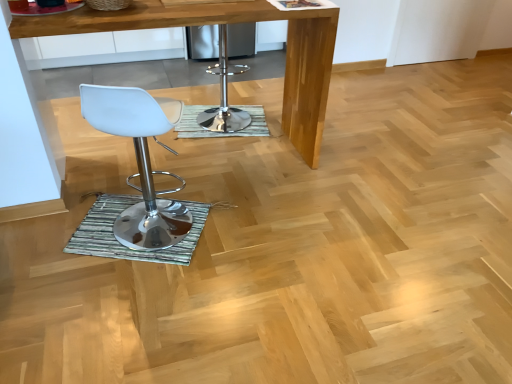
Describe the element at coordinates (220, 132) in the screenshot. This screenshot has height=384, width=512. I see `green textured mat at center, which is the second mat from bottom to top` at that location.

Find the location of a particular element. green textured mat at center, the 2th mat positioned from the top is located at coordinates (125, 246).

This screenshot has height=384, width=512. I want to click on green textured mat at center, which is the second mat from bottom to top, so click(x=220, y=132).

Does white plastic stool at left turn towards green textured mat at center, marked as the first mat in a back-to-front arrangement?

Yes, white plastic stool at left is oriented towards green textured mat at center, marked as the first mat in a back-to-front arrangement.

Which of these two, white plastic stool at left or green textured mat at center, which is the second mat from bottom to top, stands taller?

With more height is white plastic stool at left.

Would you say white plastic stool at left is to the left or to the right of green textured mat at center, which is the second mat from bottom to top, in the picture?

In the image, white plastic stool at left appears on the left side of green textured mat at center, which is the second mat from bottom to top.

What's the angular difference between white plastic stool at left and green textured mat at center, which is the second mat from bottom to top,'s facing directions?

There is a 169-degree angle between the facing directions of white plastic stool at left and green textured mat at center, which is the second mat from bottom to top.

From a real-world perspective, is white plastic stool at left positioned under wooden table at center based on gravity?

Yes, from a real-world perspective, white plastic stool at left is beneath wooden table at center.

How much distance is there between white plastic stool at left and wooden table at center?

The distance of white plastic stool at left from wooden table at center is 32.89 inches.

What's the angular difference between white plastic stool at left and wooden table at center's facing directions?

They differ by 23.8 degrees in their facing directions.

Is white plastic stool at left positioned with its back to wooden table at center?

white plastic stool at left does not have its back to wooden table at center.

Could you tell me if white plastic stool at left is facing polished chrome bar stool at center?

Yes, white plastic stool at left is oriented towards polished chrome bar stool at center.

Considering the positions of objects white plastic stool at left and polished chrome bar stool at center in the image provided, who is behind, white plastic stool at left or polished chrome bar stool at center?

polished chrome bar stool at center is more distant.

Can you see white plastic stool at left touching polished chrome bar stool at center?

No, white plastic stool at left is not next to polished chrome bar stool at center.

Is white plastic stool at left thinner than polished chrome bar stool at center?

Correct, the width of white plastic stool at left is less than that of polished chrome bar stool at center.

Are polished chrome bar stool at center and green textured mat at center, which is counted as the first mat, starting from the bottom, located far from each other?

polished chrome bar stool at center is far away from green textured mat at center, which is counted as the first mat, starting from the bottom.

Between polished chrome bar stool at center and green textured mat at center, the 2th mat positioned from the top, which one is positioned behind?

polished chrome bar stool at center is further from the camera.

Between polished chrome bar stool at center and green textured mat at center, which is counted as the first mat, starting from the bottom, which one has smaller size?

With smaller size is green textured mat at center, which is counted as the first mat, starting from the bottom.

From a real-world perspective, does polished chrome bar stool at center stand above green textured mat at center, the 2th mat positioned from the top?

Yes, from a real-world perspective, polished chrome bar stool at center is over green textured mat at center, the 2th mat positioned from the top

Does wooden table at center have a lesser width compared to white plastic stool at left?

Incorrect, the width of wooden table at center is not less than that of white plastic stool at left.

From a real-world perspective, relative to white plastic stool at left, is wooden table at center vertically above or below?

wooden table at center is situated higher than white plastic stool at left in the real world.

Could white plastic stool at left be considered to be inside wooden table at center?

No, white plastic stool at left is located outside of wooden table at center.

Who is taller, wooden table at center or white plastic stool at left?

wooden table at center is taller.

How different are the orientations of polished chrome bar stool at center and green textured mat at center, the 1th mat when ordered from top to bottom, in degrees?

The facing directions of polished chrome bar stool at center and green textured mat at center, the 1th mat when ordered from top to bottom, are 26.5 degrees apart.

Considering the relative sizes of polished chrome bar stool at center and green textured mat at center, the second mat positioned from the front, in the image provided, is polished chrome bar stool at center taller than green textured mat at center, the second mat positioned from the front,?

Yes, polished chrome bar stool at center is taller than green textured mat at center, the second mat positioned from the front.

Based on the photo, how much distance is there between polished chrome bar stool at center and green textured mat at center, the 1th mat when ordered from top to bottom?

polished chrome bar stool at center is 3.29 inches from green textured mat at center, the 1th mat when ordered from top to bottom.

Does point (220, 61) appear closer or farther from the camera than point (178, 128)?

Point (220, 61) is farther from the camera than point (178, 128).

Considering the sizes of objects green textured mat at center, the 2th mat when ordered from back to front, and green textured mat at center, marked as the first mat in a back-to-front arrangement, in the image provided, who is bigger, green textured mat at center, the 2th mat when ordered from back to front, or green textured mat at center, marked as the first mat in a back-to-front arrangement,?

With larger size is green textured mat at center, marked as the first mat in a back-to-front arrangement.

Can you confirm if green textured mat at center, the 2th mat positioned from the top, is thinner than green textured mat at center, marked as the first mat in a back-to-front arrangement?

Indeed, green textured mat at center, the 2th mat positioned from the top, has a lesser width compared to green textured mat at center, marked as the first mat in a back-to-front arrangement.

From a real-world perspective, between green textured mat at center, arranged as the first mat when viewed from the front, and green textured mat at center, the second mat positioned from the front, who is vertically higher?

green textured mat at center, arranged as the first mat when viewed from the front.

The height and width of the screenshot is (384, 512). What are the coordinates of `chair that appears below the green textured mat at center, the second mat positioned from the front (from the image's perspective)` in the screenshot? It's located at (140, 162).

The image size is (512, 384). Find the location of `table above the white plastic stool at left (from a real-world perspective)`. table above the white plastic stool at left (from a real-world perspective) is located at coordinates (225, 23).

From the image, which object appears to be farther from green textured mat at center, marked as the first mat in a back-to-front arrangement, wooden table at center or white plastic stool at left?

Based on the image, white plastic stool at left appears to be further to green textured mat at center, marked as the first mat in a back-to-front arrangement.

Which object lies nearer to the anchor point polished chrome bar stool at center, green textured mat at center, marked as the first mat in a back-to-front arrangement, or green textured mat at center, the 2th mat positioned from the top?

green textured mat at center, marked as the first mat in a back-to-front arrangement, is positioned closer to the anchor polished chrome bar stool at center.

Looking at the image, which one is located closer to white plastic stool at left, wooden table at center or green textured mat at center, marked as the first mat in a back-to-front arrangement?

green textured mat at center, marked as the first mat in a back-to-front arrangement, is closer to white plastic stool at left.

Looking at the image, which one is located further to white plastic stool at left, wooden table at center or polished chrome bar stool at center?

wooden table at center is positioned further to the anchor white plastic stool at left.

Which object lies nearer to the anchor point wooden table at center, green textured mat at center, the 2th mat positioned from the top, or green textured mat at center, marked as the first mat in a back-to-front arrangement?

green textured mat at center, marked as the first mat in a back-to-front arrangement, is positioned closer to the anchor wooden table at center.

Consider the image. From the image, which object appears to be nearer to wooden table at center, green textured mat at center, which is the second mat from bottom to top, or white plastic stool at left?

green textured mat at center, which is the second mat from bottom to top, is positioned closer to the anchor wooden table at center.

Looking at the image, which one is located further to polished chrome bar stool at center, green textured mat at center, which is the second mat from bottom to top, or white plastic stool at left?

Among the two, white plastic stool at left is located further to polished chrome bar stool at center.

Consider the image. Based on their spatial positions, is white plastic stool at left or polished chrome bar stool at center further from wooden table at center?

white plastic stool at left is further to wooden table at center.

Where is `bar stool located between white plastic stool at left and green textured mat at center, the 1th mat when ordered from top to bottom, in the depth direction`? bar stool located between white plastic stool at left and green textured mat at center, the 1th mat when ordered from top to bottom, in the depth direction is located at coordinates (224, 95).

This screenshot has height=384, width=512. In order to click on mat between white plastic stool at left and green textured mat at center, which is the second mat from bottom to top, along the z-axis in this screenshot , I will do `click(125, 246)`.

This screenshot has width=512, height=384. What are the coordinates of `bar stool between wooden table at center and green textured mat at center, marked as the first mat in a back-to-front arrangement, from front to back` in the screenshot? It's located at (224, 95).

Identify the location of chair between polished chrome bar stool at center and green textured mat at center, which is counted as the first mat, starting from the bottom, vertically. (140, 162).